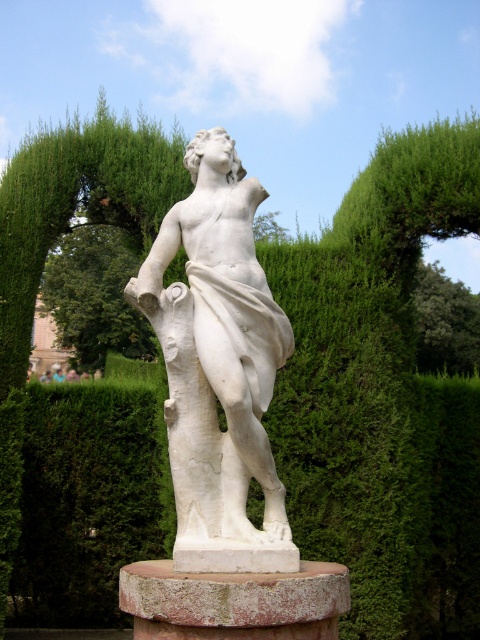
You are standing in a garden and see the white marble statue at center. If you want to touch it, how many steps do you think you need to take? Assume each step covers about 0.75 meters.

The white marble statue at center is 11.09 meters away from viewer. Dividing the distance by step length gives 11.09 divided by 0.75 equals approximately 14.79 steps. So you would need to take around 15 steps to reach it.

You are standing in the garden and want to take a photo of the green leafy tree at center. If your camera has a maximum focus range of 30 meters, will you be able to focus on the tree from your current position?

The green leafy tree at center is 31.06 meters away from the viewer. Since the camera can only focus up to 30 meters, it cannot focus on the tree from the current position.